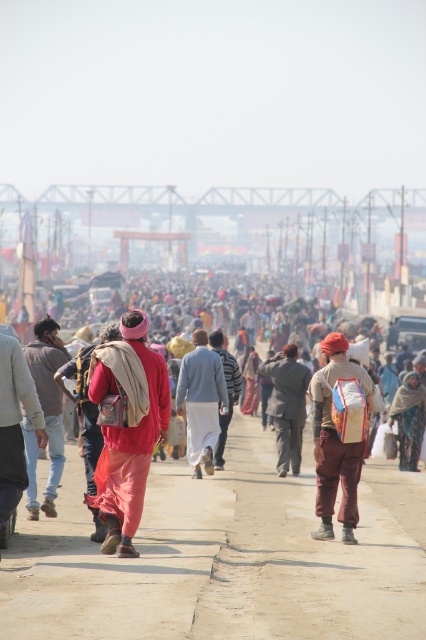
You are a photographer trying to capture a candid shot of the matte pink pants at center without the matte red backpack at center blocking the view. Is the backpack currently obscuring the pants?

The matte red backpack at center is above the matte pink pants at center, so it is blocking the view of the pants.

You are a hiker who wants to walk along the light brown dirt road at center while carrying your camouflage fabric bag at center. Can you walk on the road without the bag hanging off the side?

The light brown dirt road at center is wider than the camouflage fabric bag at center, so you can walk on the road without the bag hanging off the side.

What is the exact location of the matte red cloth at center in the image?

The matte red cloth at center is located at point coordinates (126, 428).